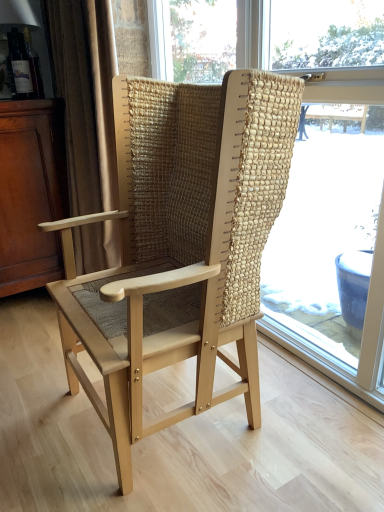
The image size is (384, 512). I want to click on vacant space in natural wood chair at center (from a real-world perspective), so click(185, 422).